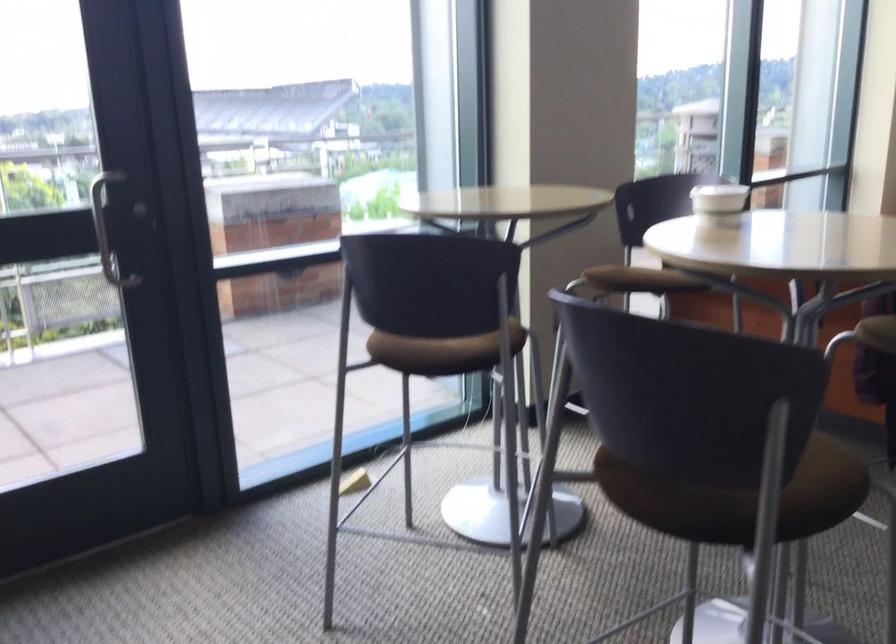
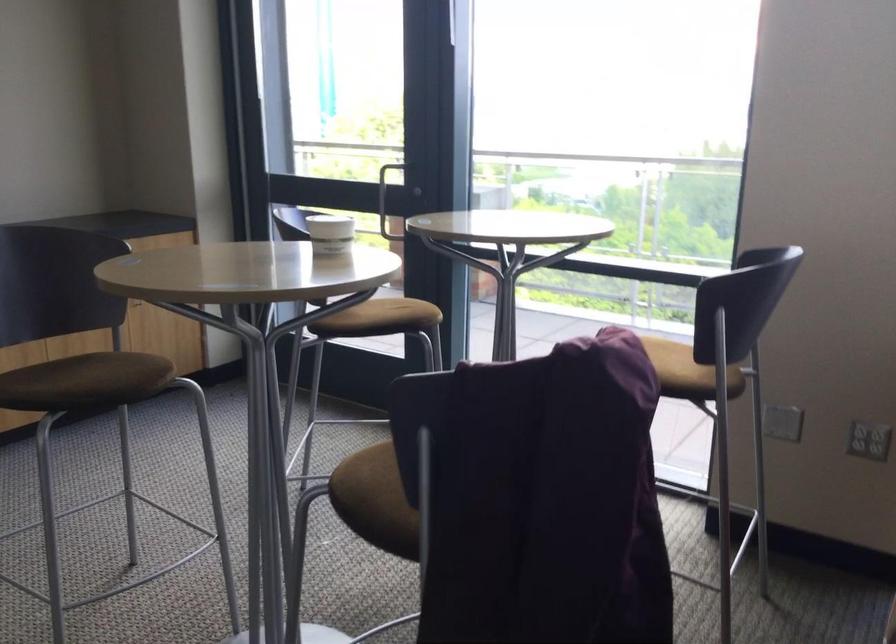
Where in the second image is the point corresponding to [716,205] from the first image?

(330, 234)